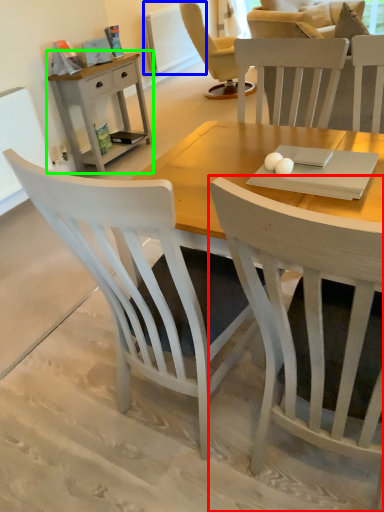
Question: Which object is the farthest from chair (highlighted by a red box)? Choose among these: radiator (highlighted by a blue box) or nightstand (highlighted by a green box).

Choices:
 (A) radiator
 (B) nightstand

Answer: (A)